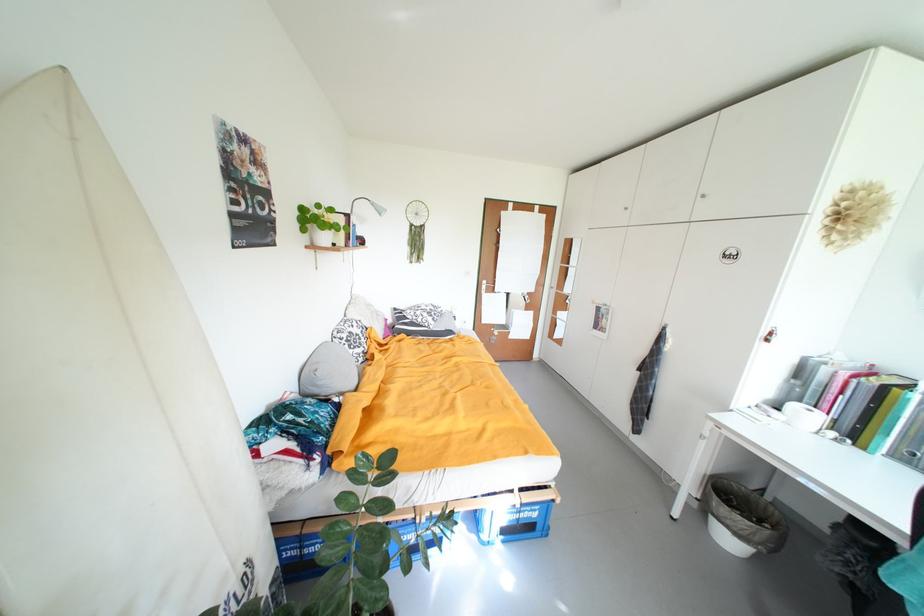
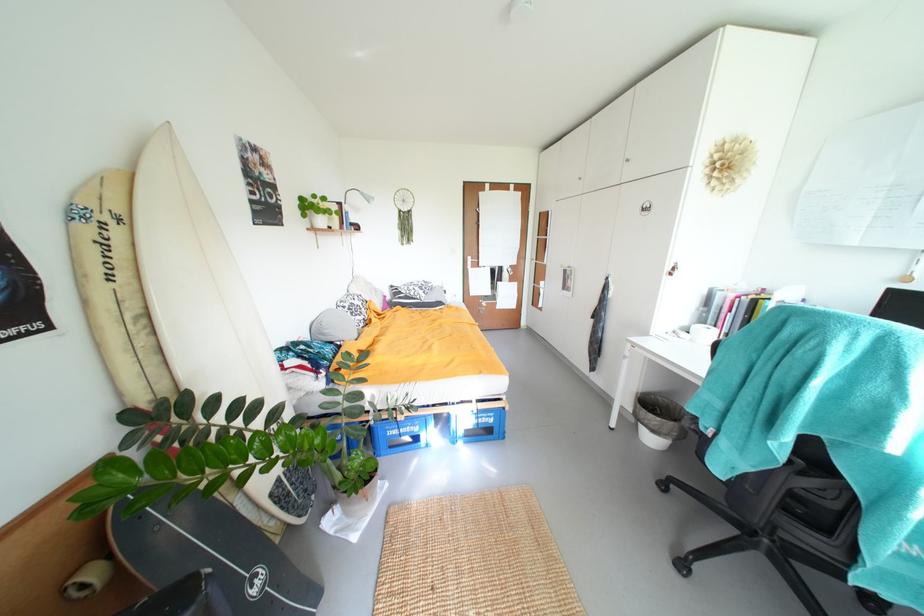
The images are taken continuously from a first-person perspective. In which direction are you moving?

The cameraman walked toward right, backward.